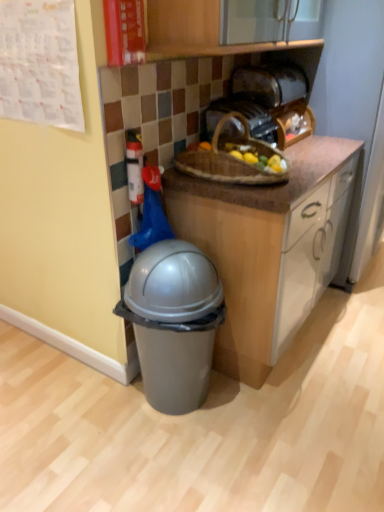
This screenshot has width=384, height=512. I want to click on free space in front of gray plastic trash can at lower left, so click(175, 466).